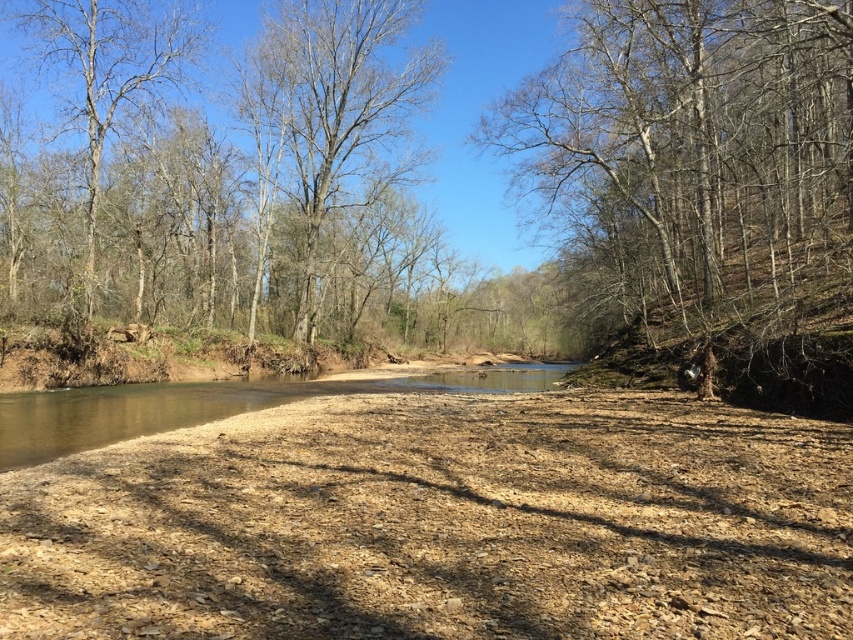
Can you confirm if brown sandy river at center is positioned below bare branches at left?

Indeed, brown sandy river at center is positioned under bare branches at left.

Which of these two, brown sandy river at center or bare branches at left, stands taller?

bare branches at left is taller.

Is point (306, 384) closer to viewer compared to point (137, 44)?

Yes, it is.

Where is `brown sandy river at center`? This screenshot has height=640, width=853. brown sandy river at center is located at coordinates click(x=202, y=404).

What do you see at coordinates (335, 109) in the screenshot? This screenshot has height=640, width=853. I see `bare wood tree at center` at bounding box center [335, 109].

The height and width of the screenshot is (640, 853). What are the coordinates of `bare wood tree at center` in the screenshot? It's located at (335, 109).

The width and height of the screenshot is (853, 640). I want to click on bare branches at upper right, so click(x=693, y=154).

Which is in front, point (628, 179) or point (328, 84)?

Positioned in front is point (628, 179).

Where is `bare branches at upper right`? Image resolution: width=853 pixels, height=640 pixels. bare branches at upper right is located at coordinates (693, 154).